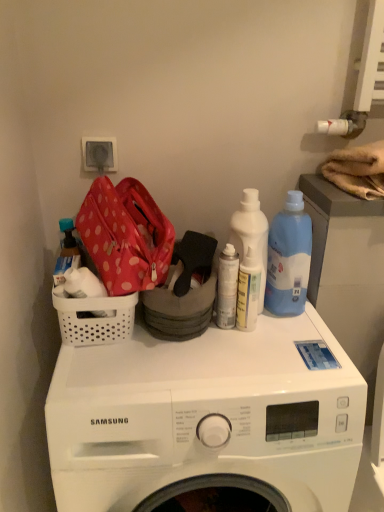
Question: Does point [52, 279] appear closer or farther from the camera than point [230, 245]?

Choices:
 (A) closer
 (B) farther

Answer: (A)

Question: Looking at their shapes, would you say translucent plastic bottle at left, the 1th bottle positioned from the left, is wider or thinner than white matte spray can at center, the 2th bottle viewed from the left?

Choices:
 (A) thin
 (B) wide

Answer: (B)

Question: Which is farther from the blue plastic bottle at upper right, acting as the 1th cleaning product starting from the right?

Choices:
 (A) translucent plastic spray bottle at center, which is counted as the 1th cleaning product, starting from the left
 (B) white matte spray can at center, the 2th bottle viewed from the left
 (C) white plastic basket at left
 (D) translucent plastic bottle at left, the second bottle when ordered from right to left
 (E) white plastic washing machine at center

Answer: (D)

Question: Which is nearer to the white matte spray can at center, the 2th bottle viewed from the left?

Choices:
 (A) translucent plastic spray bottle at center, which is counted as the third cleaning product, starting from the right
 (B) white plastic washing machine at center
 (C) blue plastic bottle at upper right, which appears as the 3th cleaning product when viewed from the left
 (D) white plastic electric outlet at upper left
 (E) white plastic basket at left

Answer: (A)